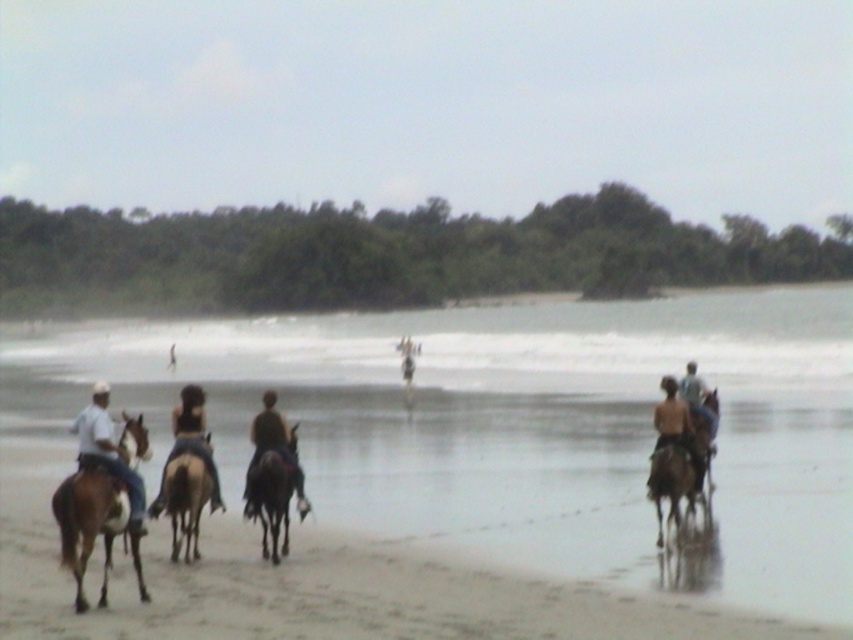
Question: Where is dark brown leather boots at center located in relation to brown leather boots at lower left in the image?

Choices:
 (A) below
 (B) above

Answer: (B)

Question: Which object appears farthest from the camera in this image?

Choices:
 (A) brown sandy beach at lower left
 (B) brown glossy horse at left
 (C) shiny brown horse at right

Answer: (C)

Question: Does brown glossy horse at left have a lesser width compared to dark brown leather boots at center?

Choices:
 (A) yes
 (B) no

Answer: (A)

Question: Which of these objects is positioned closest to the dark brown horse at center?

Choices:
 (A) brown glossy horse at left
 (B) shiny brown horse at right
 (C) brown sandy beach at lower left
 (D) brown glossy horse at center

Answer: (D)

Question: Does light brown leather pants at left have a larger size compared to dark brown leather boots at center?

Choices:
 (A) no
 (B) yes

Answer: (A)

Question: Which point is closer to the camera?

Choices:
 (A) (207, 458)
 (B) (567, 609)
 (C) (135, 570)

Answer: (B)